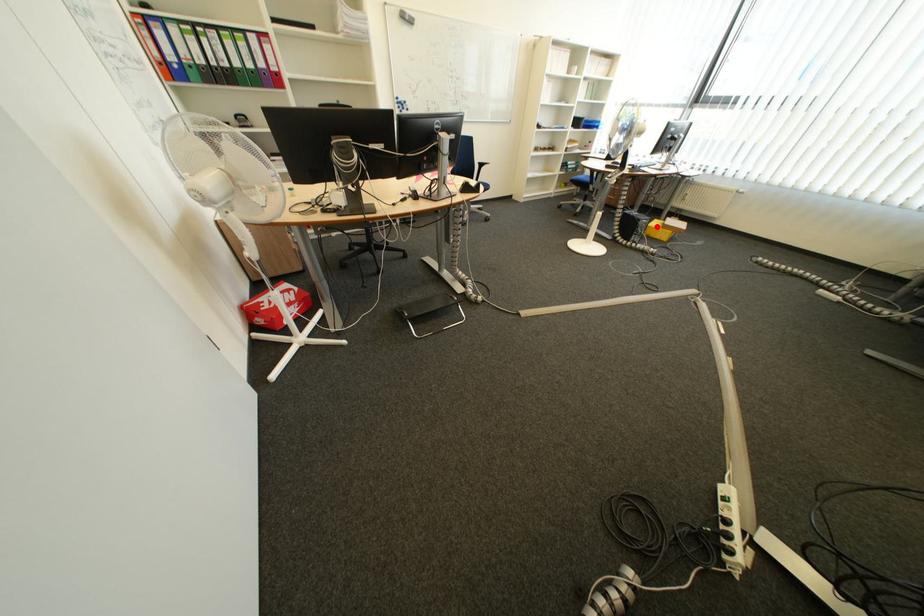
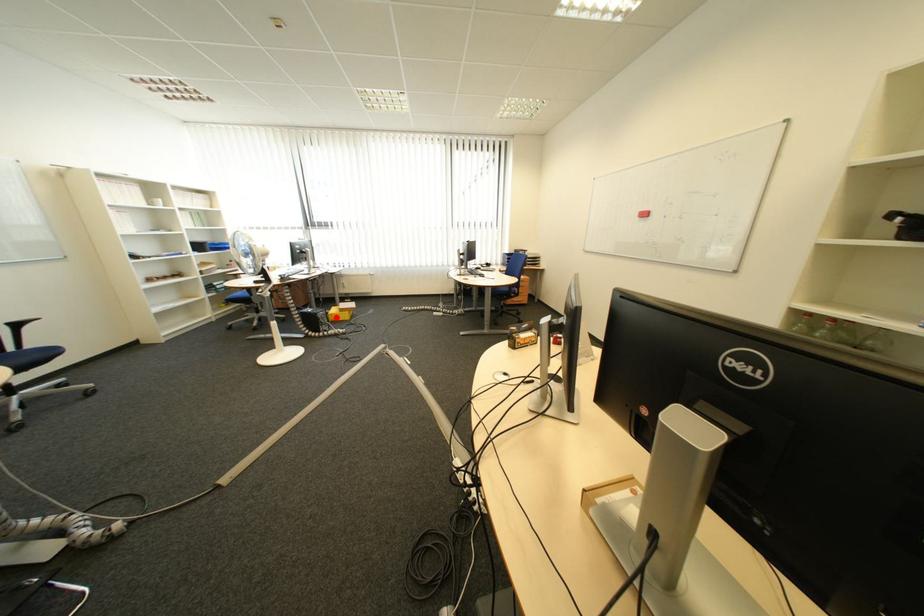
I am providing you with two images of the same scene from different viewpoints. A red point is marked on the first image and another point is marked on the second image. Is the marked point in image1 the same physical position as the marked point in image2?

Yes